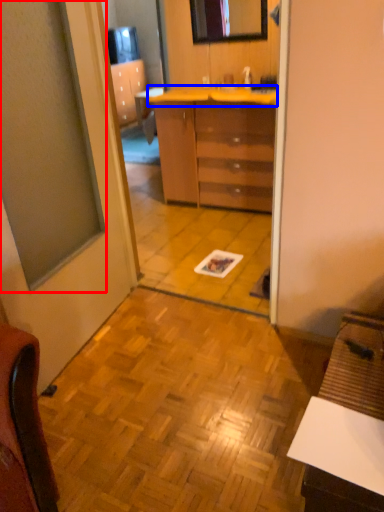
Question: Among these objects, which one is nearest to the camera, window (highlighted by a red box) or counter top (highlighted by a blue box)?

Choices:
 (A) window
 (B) counter top

Answer: (A)